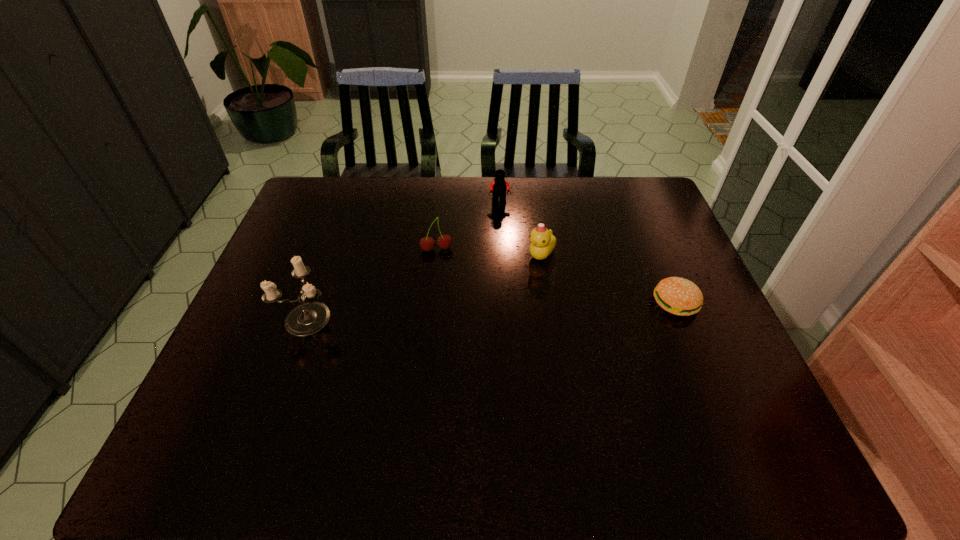
I want to click on vacant point located between the duckling and the cherry, so click(489, 252).

This screenshot has width=960, height=540. Find the location of `free spot between the patty and the Lego`. free spot between the patty and the Lego is located at coordinates (588, 253).

Image resolution: width=960 pixels, height=540 pixels. What are the coordinates of `free point between the Lego and the second object from right to left` in the screenshot? It's located at [520, 228].

You are a GUI agent. You are given a task and a screenshot of the screen. Output one action in this format:
    pyautogui.click(x=<x>, y=<y>)
    Task: Click on the empty space that is in between the fourth object from right to left and the third object from right to left
    This screenshot has height=540, width=960.
    Given the screenshot: What is the action you would take?
    pyautogui.click(x=468, y=226)

Where is `empty space between the shortest object and the cherry`? The image size is (960, 540). empty space between the shortest object and the cherry is located at coordinates (556, 276).

I want to click on free point between the patty and the fourth object from left to right, so 609,279.

Choose which object is the third nearest neighbor to the patty. Please provide its 2D coordinates. Your answer should be formatted as a tuple, i.e. [(x, y)], where the tuple contains the x and y coordinates of a point satisfying the conditions above.

[(427, 243)]

Identify which object is the second nearest to the second object from left to right. Please provide its 2D coordinates. Your answer should be formatted as a tuple, i.e. [(x, y)], where the tuple contains the x and y coordinates of a point satisfying the conditions above.

[(542, 240)]